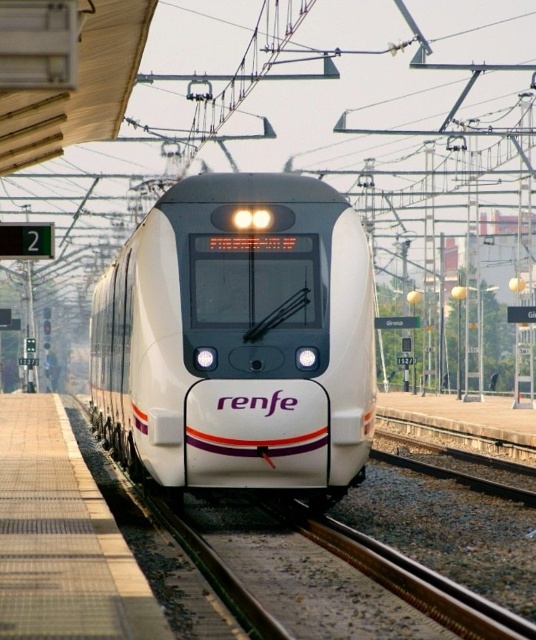
Is point (98, 300) positioned after point (63, 429)?

Yes, it is behind point (63, 429).

How far apart are white glossy train at center and smooth concrete platform at lower left?

white glossy train at center is 2.07 meters away from smooth concrete platform at lower left.

At what (x,y) coordinates should I click in order to perform the action: click on white glossy train at center. Please return your answer as a coordinate pair (x, y). This screenshot has width=536, height=640. Looking at the image, I should click on (239, 339).

Identify the location of white glossy train at center. The image size is (536, 640). (239, 339).